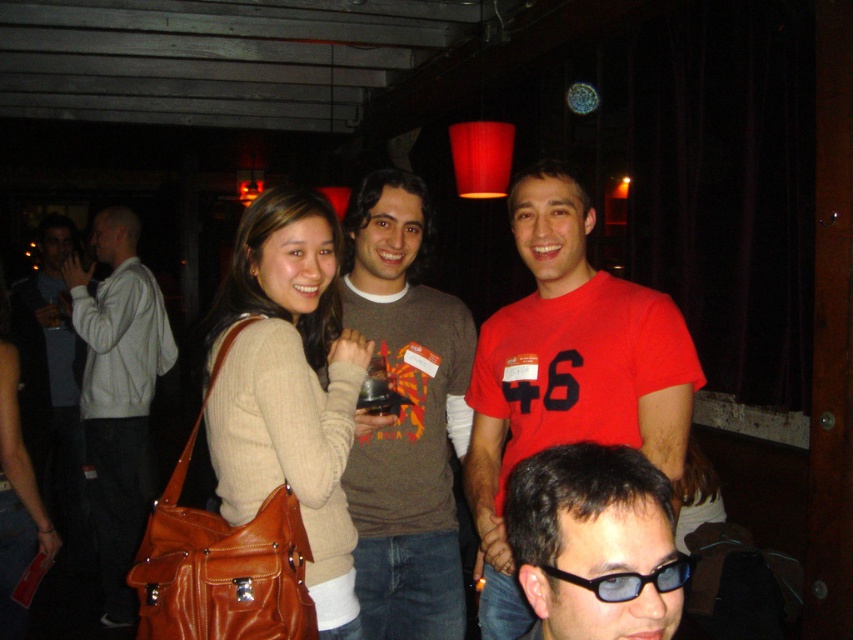
Question: Which object appears farthest from the camera in this image?

Choices:
 (A) matte beige sweater at center
 (B) matte red t-shirt at center
 (C) white cotton hoodie at left
 (D) blue tinted glasses at center

Answer: (C)

Question: Observing the image, what is the correct spatial positioning of white cotton hoodie at left in reference to black glossy glasses at center?

Choices:
 (A) above
 (B) below

Answer: (B)

Question: Is matte beige sweater at center to the right of matte brown sweater at center from the viewer's perspective?

Choices:
 (A) yes
 (B) no

Answer: (B)

Question: Which of the following is the closest to the observer?

Choices:
 (A) (170, 362)
 (B) (686, 556)

Answer: (B)

Question: Is matte red t-shirt at center thinner than blue tinted glasses at center?

Choices:
 (A) no
 (B) yes

Answer: (A)

Question: Based on their relative distances, which object is nearer to the matte beige sweater at center?

Choices:
 (A) matte brown sweater at center
 (B) white cotton hoodie at left

Answer: (A)